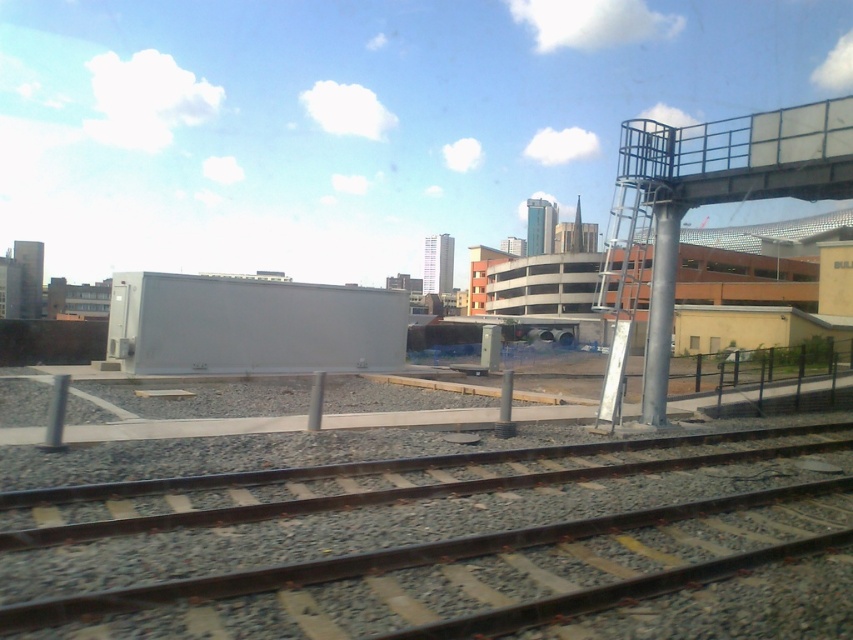
You are a maintenance worker needing to place a 2.5 meter long equipment between the rusty metal train track at lower center and the metallic blue railing at upper right. Can the equipment fit there?

The rusty metal train track at lower center might be wider than metallic blue railing at upper right, so the equipment might fit if the distance between them is at least 2.5 meters. However, the exact width isn not specified, so it is uncertain.

You are a maintenance worker needing to inspect both the rusty metal train track at lower center and the metallic blue railing at upper right. Based on their positions, which one would you need to climb upwards to reach from your current position at the lower center?

You would need to climb upwards to reach the metallic blue railing at upper right since it is located above the rusty metal train track at lower center.

You are a photographer standing on the platform and want to take a photo of the rusty metal train track at lower center and the metallic blue railing at upper right. Which object will appear larger in the photo?

The rusty metal train track at lower center will appear larger in the photo because it is closer to the viewer than the metallic blue railing at upper right.